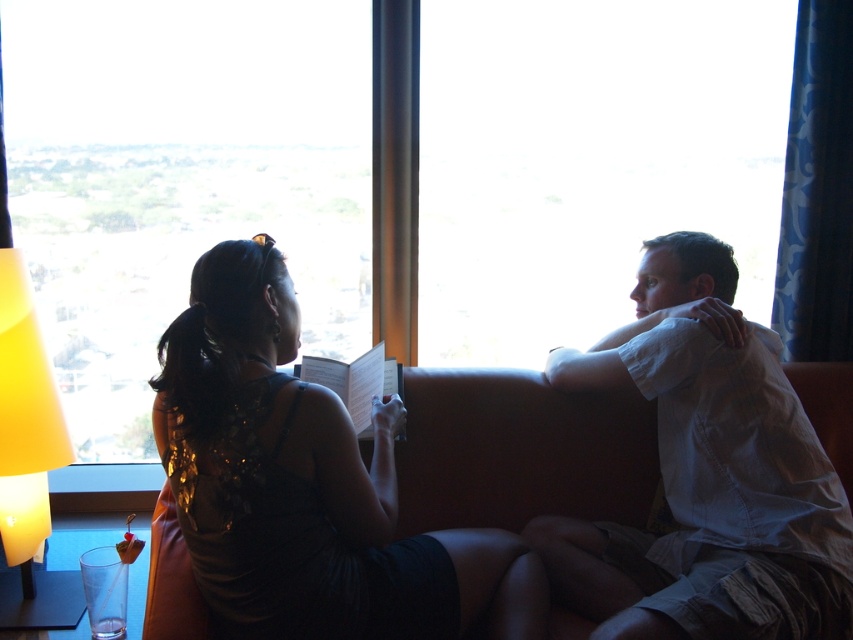
Question: Estimate the real-world distances between objects in this image. Which object is closer to the translucent yellow lampshade at left?

Choices:
 (A) white cotton shirt at right
 (B) white paper book at center
 (C) black sequined dress at center

Answer: (C)

Question: Estimate the real-world distances between objects in this image. Which object is closer to the transparent glass window at upper center?

Choices:
 (A) orange leather couch at center
 (B) translucent yellow lampshade at left

Answer: (B)

Question: Which object is the farthest from the transparent glass window at upper center?

Choices:
 (A) white cotton shirt at right
 (B) white paper book at center
 (C) orange leather couch at center
 (D) black sequined dress at center

Answer: (A)

Question: Does white cotton shirt at right appear over translucent yellow lampshade at left?

Choices:
 (A) no
 (B) yes

Answer: (B)

Question: Is white cotton shirt at right further to camera compared to orange leather couch at center?

Choices:
 (A) yes
 (B) no

Answer: (B)

Question: Is white cotton shirt at right further to the viewer compared to white paper book at center?

Choices:
 (A) no
 (B) yes

Answer: (A)